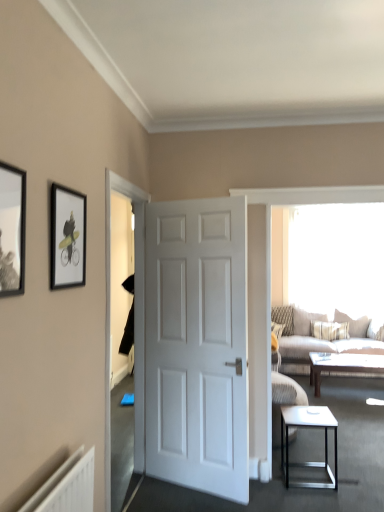
Question: From a real-world perspective, is transparent glass window screen at upper right below white matte door at center?

Choices:
 (A) no
 (B) yes

Answer: (A)

Question: Is transparent glass window screen at upper right turned away from white matte door at center?

Choices:
 (A) yes
 (B) no

Answer: (B)

Question: From the image's perspective, is transparent glass window screen at upper right on white matte door at center?

Choices:
 (A) no
 (B) yes

Answer: (B)

Question: Does transparent glass window screen at upper right have a greater width compared to white matte door at center?

Choices:
 (A) no
 (B) yes

Answer: (A)

Question: Can you confirm if transparent glass window screen at upper right is shorter than white matte door at center?

Choices:
 (A) yes
 (B) no

Answer: (A)

Question: Considering the relative positions of transparent glass window screen at upper right and white matte door at center in the image provided, is transparent glass window screen at upper right to the left of white matte door at center from the viewer's perspective?

Choices:
 (A) yes
 (B) no

Answer: (B)

Question: Is white glossy door at center in front of beige textured pillow at right, the 2th pillow in the right-to-left sequence?

Choices:
 (A) yes
 (B) no

Answer: (A)

Question: Can you confirm if white glossy door at center is taller than beige textured pillow at right, arranged as the second pillow when viewed from the left?

Choices:
 (A) yes
 (B) no

Answer: (A)

Question: Does white glossy door at center have a greater width compared to beige textured pillow at right, the 2th pillow in the right-to-left sequence?

Choices:
 (A) no
 (B) yes

Answer: (A)

Question: Would you say beige textured pillow at right, the 2th pillow in the right-to-left sequence, is part of white glossy door at center's contents?

Choices:
 (A) no
 (B) yes

Answer: (A)

Question: From the image's perspective, is white glossy door at center below beige textured pillow at right, the 2th pillow in the right-to-left sequence?

Choices:
 (A) no
 (B) yes

Answer: (A)

Question: Is white glossy door at center bigger than beige textured pillow at right, the 2th pillow in the right-to-left sequence?

Choices:
 (A) yes
 (B) no

Answer: (A)

Question: Is matte black picture frame at left, arranged as the second picture frame when viewed from the back, not near white glossy side table at lower right?

Choices:
 (A) yes
 (B) no

Answer: (A)